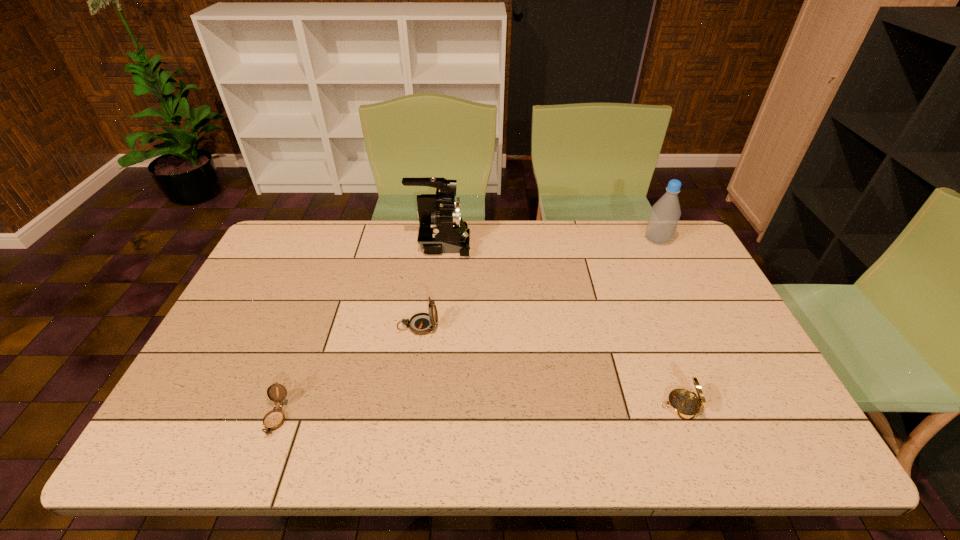
The image size is (960, 540). What are the coordinates of `vacant space at the near edge of the desktop` in the screenshot? It's located at (400, 446).

In the image, there is a desktop. Find the location of `free space at the left edge`. free space at the left edge is located at coordinates (276, 280).

Image resolution: width=960 pixels, height=540 pixels. In order to click on vacant space at the right edge of the desktop in this screenshot , I will do `click(676, 306)`.

This screenshot has height=540, width=960. I want to click on vacant area at the far right corner, so click(645, 225).

This screenshot has width=960, height=540. I want to click on free space that is in between the rightmost compass and the bottle, so click(669, 323).

Image resolution: width=960 pixels, height=540 pixels. I want to click on free point between the second shortest object and the camcorder, so click(561, 325).

You are a GUI agent. You are given a task and a screenshot of the screen. Output one action in this format:
    pyautogui.click(x=<x>, y=<y>)
    Task: Click on the empty space that is in between the third tallest object and the camcorder
    
    Given the screenshot: What is the action you would take?
    pyautogui.click(x=429, y=285)

The width and height of the screenshot is (960, 540). Find the location of `empty space between the rightmost compass and the rightmost object`. empty space between the rightmost compass and the rightmost object is located at coordinates (669, 323).

In order to click on free spot between the rightmost object and the third farthest object in this screenshot , I will do `click(538, 283)`.

Where is `vacant space in between the tallest compass and the second object from right to left`? Image resolution: width=960 pixels, height=540 pixels. vacant space in between the tallest compass and the second object from right to left is located at coordinates (549, 366).